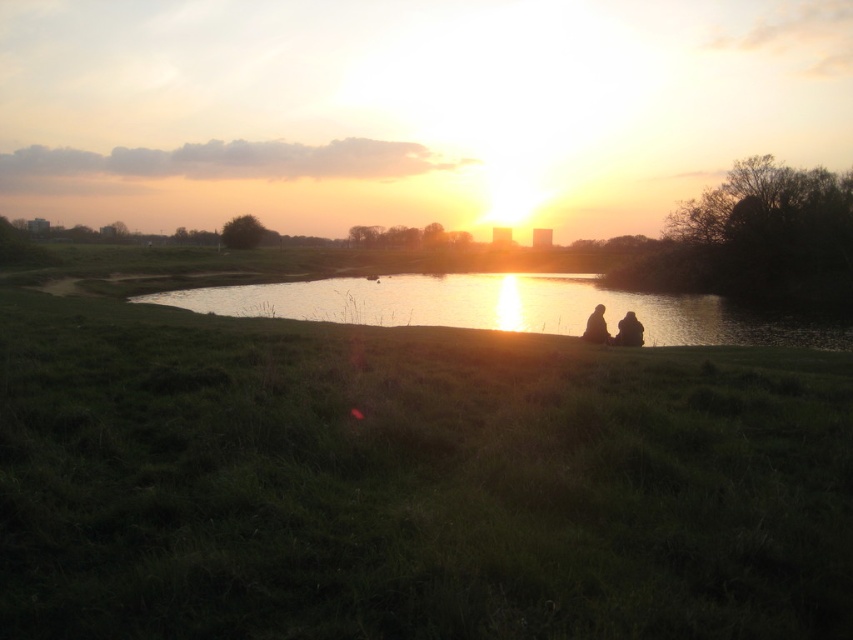
Question: Does matte black person at lower right lie behind silhouette figure at center?

Choices:
 (A) yes
 (B) no

Answer: (A)

Question: Is silvery reflective water at center smaller than silhouette figure at center?

Choices:
 (A) yes
 (B) no

Answer: (B)

Question: Among these objects, which one is nearest to the camera?

Choices:
 (A) green grassy at center
 (B) matte black person at lower right
 (C) silvery reflective water at center

Answer: (A)

Question: Is the position of silvery reflective water at center less distant than that of silhouette figure at center?

Choices:
 (A) yes
 (B) no

Answer: (B)

Question: Which point is farther to the camera?

Choices:
 (A) (102, 440)
 (B) (276, 289)

Answer: (B)

Question: Estimate the real-world distances between objects in this image. Which object is closer to the silhouette figure at center?

Choices:
 (A) green grassy at center
 (B) matte black person at lower right
 (C) silhouette fabric couple at center
 (D) silvery reflective water at center

Answer: (C)